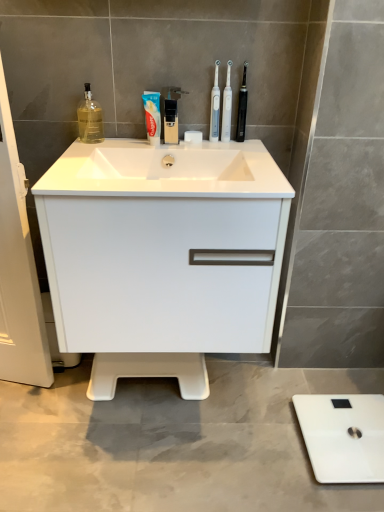
Question: Is black plastic toothbrush at upper center, the third toothbrush in the left-to-right sequence, aimed at white glossy cabinet at center?

Choices:
 (A) no
 (B) yes

Answer: (A)

Question: Is black plastic toothbrush at upper center, the third toothbrush in the left-to-right sequence, far away from white glossy cabinet at center?

Choices:
 (A) no
 (B) yes

Answer: (A)

Question: Would you say white glossy cabinet at center is part of black plastic toothbrush at upper center, the third toothbrush in the left-to-right sequence,'s contents?

Choices:
 (A) yes
 (B) no

Answer: (B)

Question: From the image's perspective, is black plastic toothbrush at upper center, the first toothbrush viewed from the right, located above white glossy cabinet at center?

Choices:
 (A) no
 (B) yes

Answer: (B)

Question: Is black plastic toothbrush at upper center, the third toothbrush in the left-to-right sequence, not inside white glossy cabinet at center?

Choices:
 (A) yes
 (B) no

Answer: (A)

Question: Considering the relative positions of white glossy sink at center and white matte scale at lower right in the image provided, is white glossy sink at center to the left or to the right of white matte scale at lower right?

Choices:
 (A) right
 (B) left

Answer: (B)

Question: Considering the positions of white glossy sink at center and white matte scale at lower right in the image, is white glossy sink at center bigger or smaller than white matte scale at lower right?

Choices:
 (A) big
 (B) small

Answer: (A)

Question: In terms of width, does white glossy sink at center look wider or thinner when compared to white matte scale at lower right?

Choices:
 (A) wide
 (B) thin

Answer: (A)

Question: From the image's perspective, is white glossy sink at center located above or below white matte scale at lower right?

Choices:
 (A) above
 (B) below

Answer: (A)

Question: Based on their positions, is black plastic faucet at upper center located to the left or right of clear glass bottle at upper left?

Choices:
 (A) left
 (B) right

Answer: (B)

Question: Choose the correct answer: Is black plastic faucet at upper center inside clear glass bottle at upper left or outside it?

Choices:
 (A) outside
 (B) inside

Answer: (A)

Question: Based on their sizes in the image, would you say black plastic faucet at upper center is bigger or smaller than clear glass bottle at upper left?

Choices:
 (A) small
 (B) big

Answer: (B)

Question: Considering their positions, is black plastic faucet at upper center located in front of or behind clear glass bottle at upper left?

Choices:
 (A) front
 (B) behind

Answer: (A)

Question: Is white glossy toothbrush at upper center, which is the second toothbrush in right-to-left order, inside or outside of white matte scale at lower right?

Choices:
 (A) inside
 (B) outside

Answer: (B)

Question: From the image's perspective, relative to white matte scale at lower right, is white glossy toothbrush at upper center, which is the second toothbrush in right-to-left order, above or below?

Choices:
 (A) above
 (B) below

Answer: (A)